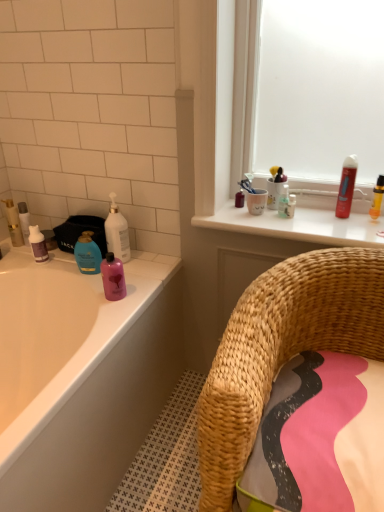
The width and height of the screenshot is (384, 512). What are the coordinates of `blank area to the left of translucent plastic toothbrush holder at upper center, the 5th toiletry when ordered from left to right` in the screenshot? It's located at (250, 216).